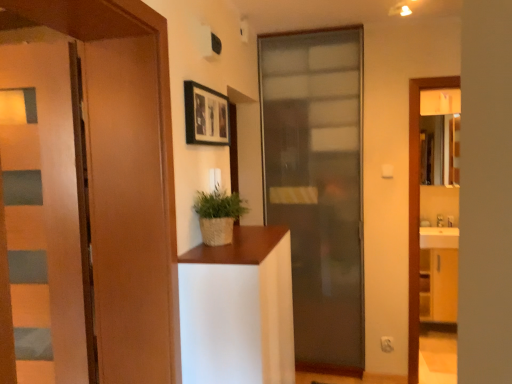
Question: From the image's perspective, is braided straw pot at center under black matte picture frame at upper center?

Choices:
 (A) yes
 (B) no

Answer: (A)

Question: Is braided straw pot at center smaller than black matte picture frame at upper center?

Choices:
 (A) yes
 (B) no

Answer: (B)

Question: Is braided straw pot at center thinner than black matte picture frame at upper center?

Choices:
 (A) yes
 (B) no

Answer: (B)

Question: Does braided straw pot at center have a greater height compared to black matte picture frame at upper center?

Choices:
 (A) no
 (B) yes

Answer: (A)

Question: Does braided straw pot at center come behind black matte picture frame at upper center?

Choices:
 (A) no
 (B) yes

Answer: (A)

Question: From a real-world perspective, is braided straw pot at center beneath black matte picture frame at upper center?

Choices:
 (A) no
 (B) yes

Answer: (B)

Question: Is wooden door at left, arranged as the 1th door when viewed from the left, wider than braided straw pot at center?

Choices:
 (A) yes
 (B) no

Answer: (B)

Question: Is wooden door at left, which is the 2th door in front-to-back order, facing away from braided straw pot at center?

Choices:
 (A) yes
 (B) no

Answer: (B)

Question: From a real-world perspective, is wooden door at left, placed as the 2th door when sorted from back to front, positioned under braided straw pot at center based on gravity?

Choices:
 (A) no
 (B) yes

Answer: (A)

Question: Considering the relative sizes of wooden door at left, the third door positioned from the right, and braided straw pot at center in the image provided, is wooden door at left, the third door positioned from the right, shorter than braided straw pot at center?

Choices:
 (A) yes
 (B) no

Answer: (B)

Question: Is wooden door at left, placed as the 2th door when sorted from back to front, positioned far away from braided straw pot at center?

Choices:
 (A) yes
 (B) no

Answer: (B)

Question: Is wooden door at left, arranged as the 1th door when viewed from the left, closer to the viewer compared to braided straw pot at center?

Choices:
 (A) yes
 (B) no

Answer: (A)

Question: Does braided straw pot at center have a greater width compared to wooden door at left, arranged as the 1th door when viewed from the left?

Choices:
 (A) no
 (B) yes

Answer: (B)